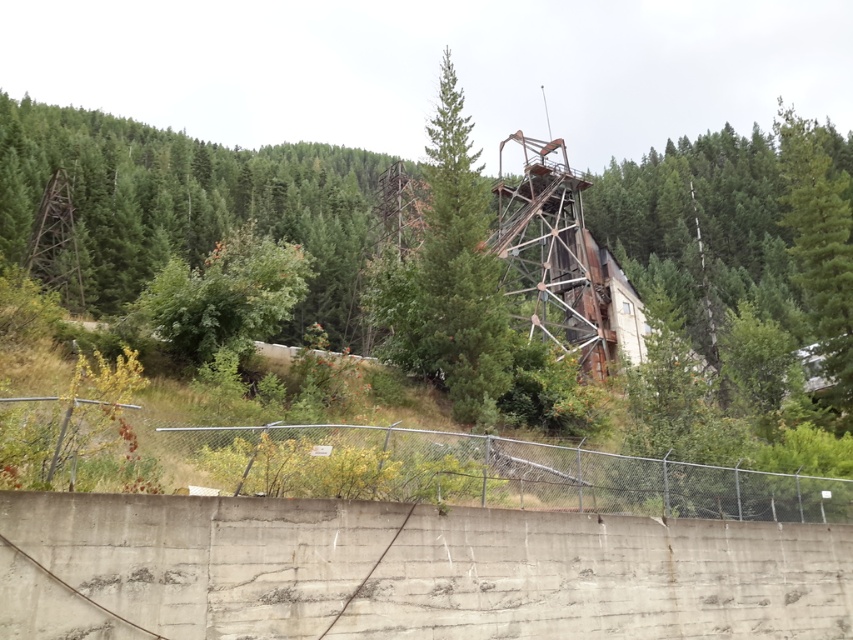
You are a photographer planning to capture the rusty metal structure at center and the green matte tree at upper right in a single frame. Based on their relative sizes, which object should you position closer to the camera to ensure both are visible in the frame?

The rusty metal structure at center might be wider than green matte tree at upper right, so positioning the rusty metal structure at center closer to the camera would help ensure both fit within the frame by adjusting their apparent sizes.

Consider the image. You are a hiker who has stumbled upon this abandoned industrial site. You notice the rusty metal structure at center and the green matte tree at center. From your vantage point, which object appears closer to you?

The rusty metal structure at center appears closer because the green matte tree at center is positioned behind it.

You are a photographer planning to capture the rusty metal structure at center and the green matte tree at center in a single frame. Based on their heights, which one should you position closer to the camera to ensure both are fully visible?

The rusty metal structure at center is taller than the green matte tree at center. To ensure both are fully visible in the frame, position the rusty metal structure at center closer to the camera so its height can be accommodated without cropping the tree.